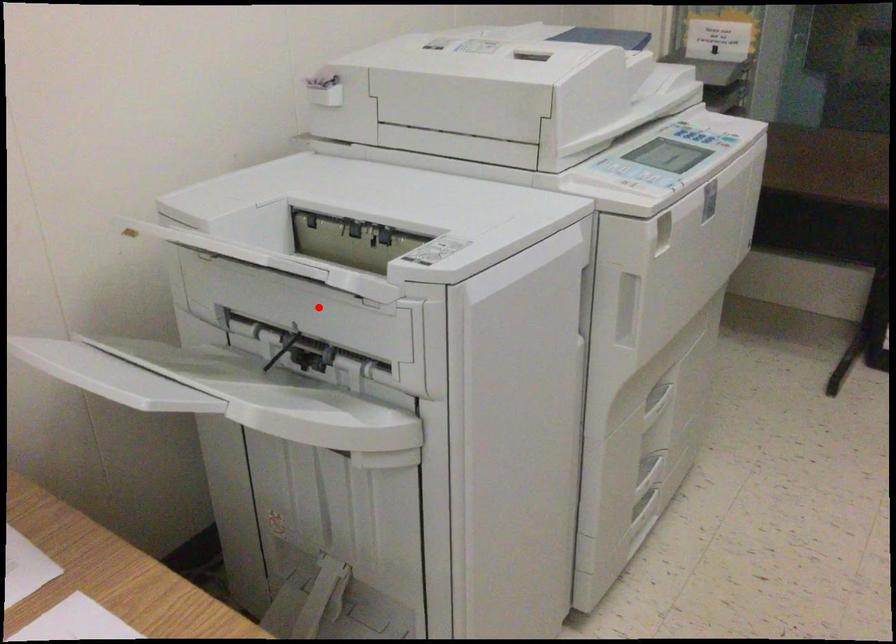
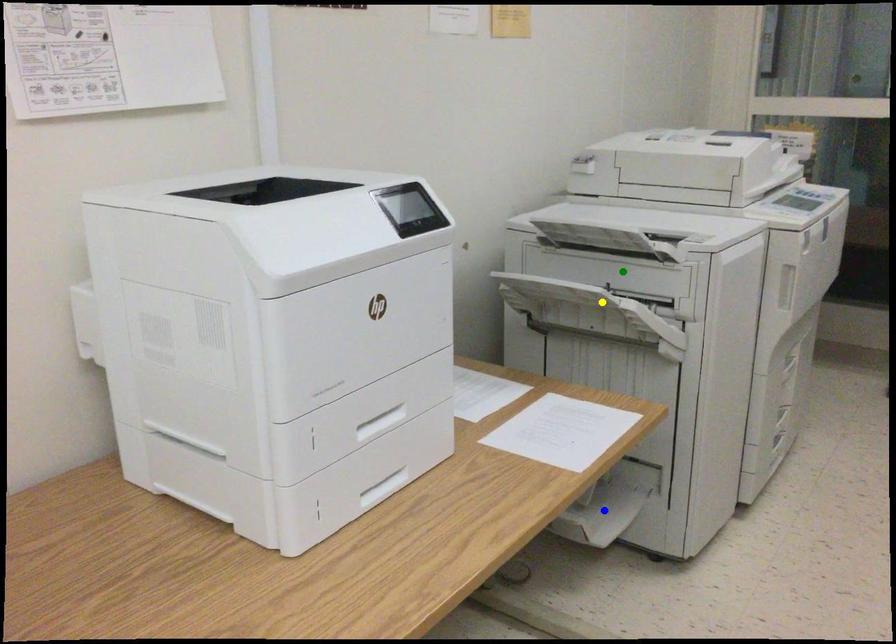
Question: I am providing you with two images of the same scene from different viewpoints. A red point is marked on the first image. You are given multiple points on the second image. Which point in image 2 is actually the same real-world point as the red point in image 1?

Choices:
 (A) yellow point
 (B) green point
 (C) blue point

Answer: (B)